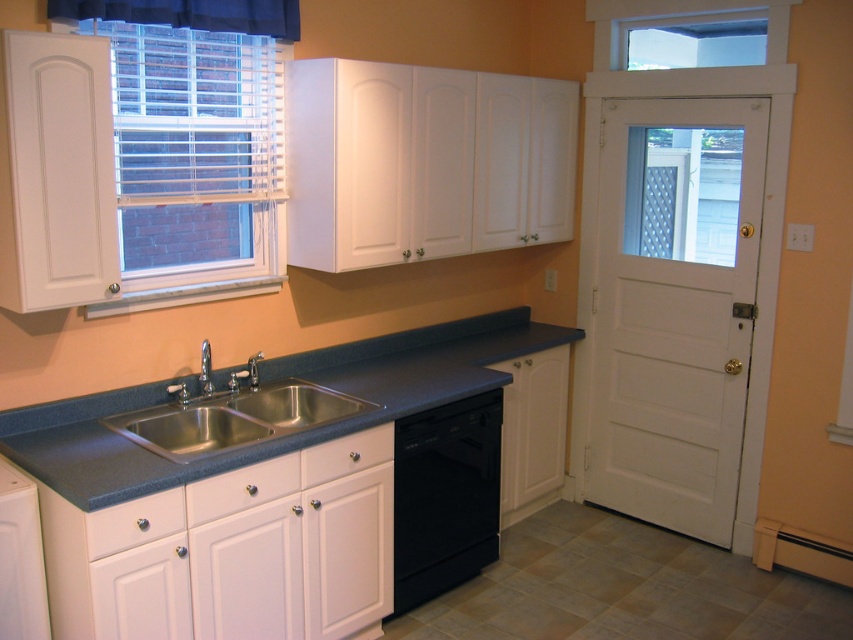
Question: Is white blinds at upper left closer to the viewer compared to dark gray laminate countertop at lower center?

Choices:
 (A) no
 (B) yes

Answer: (A)

Question: Does dark gray laminate countertop at lower center have a greater width compared to black matte dishwasher at lower center?

Choices:
 (A) yes
 (B) no

Answer: (A)

Question: Which object is farther from the camera taking this photo?

Choices:
 (A) satin nickel faucet at sink left
 (B) stainless steel sink at center
 (C) black fabric curtain at upper left
 (D) white blinds at upper left

Answer: (A)

Question: Which of the following is the closest to the observer?

Choices:
 (A) stainless steel sink at center
 (B) white glossy cabinet at lower left

Answer: (B)

Question: Is black matte dishwasher at lower center positioned at the back of black fabric curtain at upper left?

Choices:
 (A) yes
 (B) no

Answer: (A)

Question: Estimate the real-world distances between objects in this image. Which object is farther from the black matte dishwasher at lower center?

Choices:
 (A) white glossy cabinet at lower left
 (B) satin nickel faucet at sink left
 (C) dark gray laminate countertop at lower center
 (D) black fabric curtain at upper left

Answer: (D)